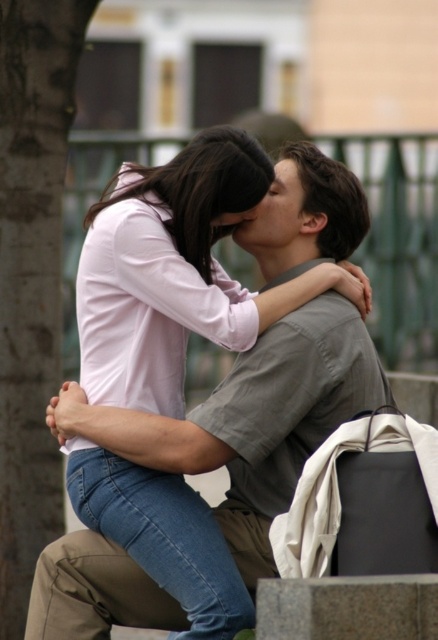
Is matte pink shirt at center smaller than brown rough tree trunk at left?

No, matte pink shirt at center is not smaller than brown rough tree trunk at left.

Is point (95, 563) behind point (29, 490)?

No, it is in front of (29, 490).

Is point (285, 412) positioned in front of point (67, 52)?

Yes, point (285, 412) is in front of point (67, 52).

Locate an element on the screen. This screenshot has width=438, height=640. matte pink shirt at center is located at coordinates (253, 420).